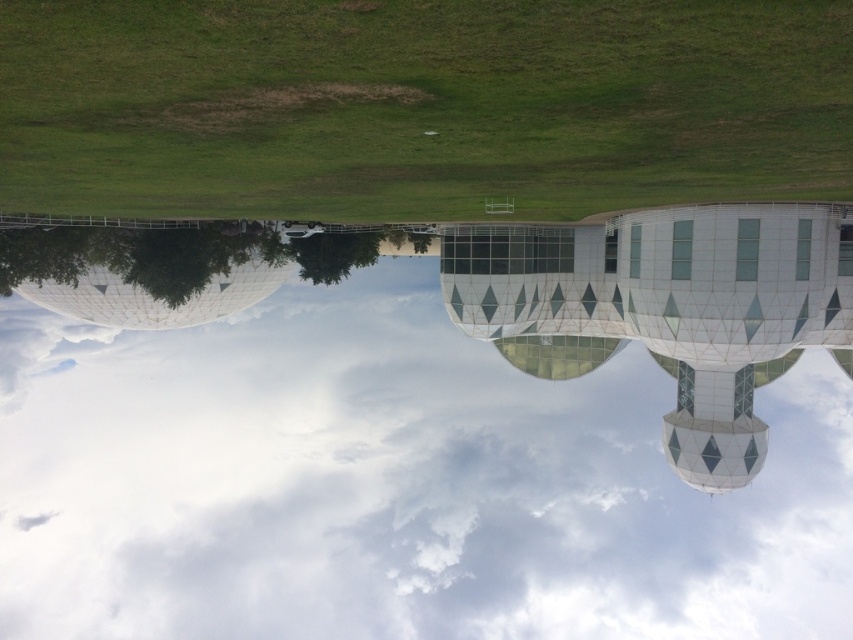
Question: Is white cloud at upper center closer to camera compared to green grass at center?

Choices:
 (A) no
 (B) yes

Answer: (A)

Question: Among these objects, which one is nearest to the camera?

Choices:
 (A) white cloud at upper center
 (B) green grass at center

Answer: (B)

Question: Is white cloud at upper center positioned at the back of green grass at center?

Choices:
 (A) yes
 (B) no

Answer: (A)

Question: Which of the following is the farthest from the observer?

Choices:
 (A) (193, 401)
 (B) (669, 148)

Answer: (A)

Question: Can you confirm if white cloud at upper center is thinner than green grass at center?

Choices:
 (A) no
 (B) yes

Answer: (A)